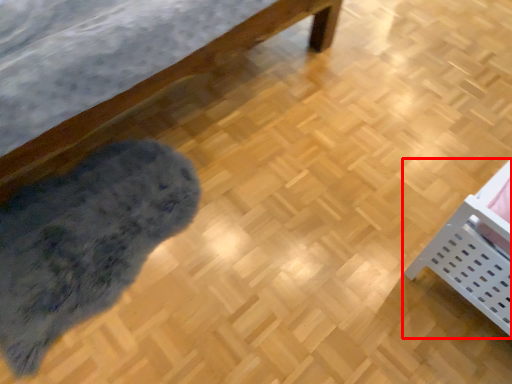
Question: From the image's perspective, what is the correct spatial positioning of furniture (annotated by the red box) in reference to mat?

Choices:
 (A) below
 (B) above

Answer: (B)